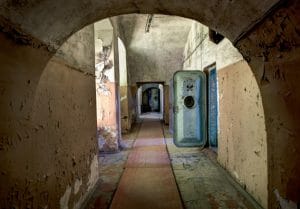
The height and width of the screenshot is (209, 300). Find the location of `arch`. arch is located at coordinates (101, 7).